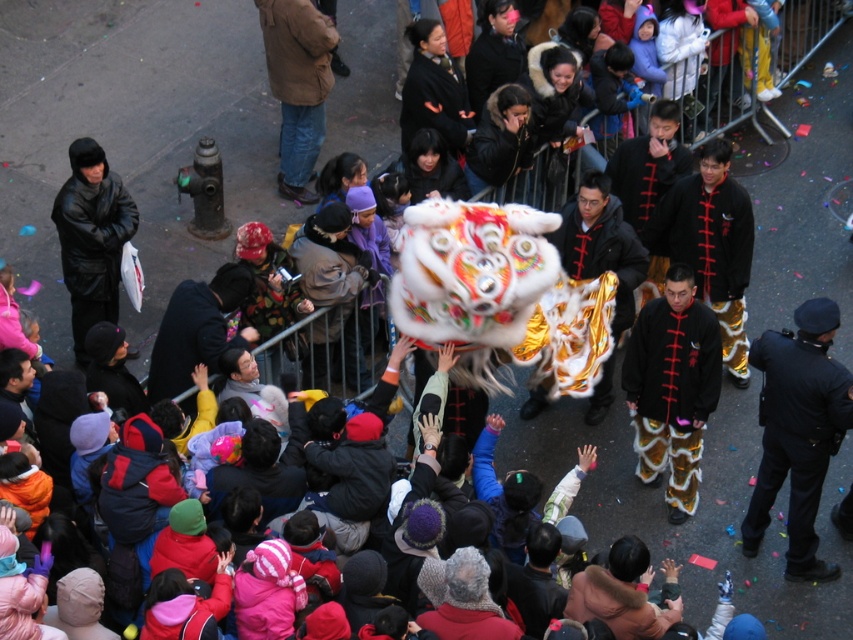
You are standing at the point labeled as point (x=293, y=99) and want to move towards the lion dance performance. There is an obstacle at point (x=799, y=308). Can you walk directly towards the lion dance performance without going around the obstacle?

Since point (x=799, y=308) is in front of point (x=293, y=99), the obstacle is blocking your path towards the lion dance performance. You will need to go around the obstacle to reach the performance.

You are a photographer at the event and want to capture both the black uniform at right and the black leather jacket at upper left in a single frame. Considering their heights, which one should you focus on to ensure both are visible in the photo?

The black uniform at right is much taller than the black leather jacket at upper left, so focusing on the black uniform at right would allow both to be visible in the photo as it can accommodate the shorter black leather jacket at upper left within the frame.